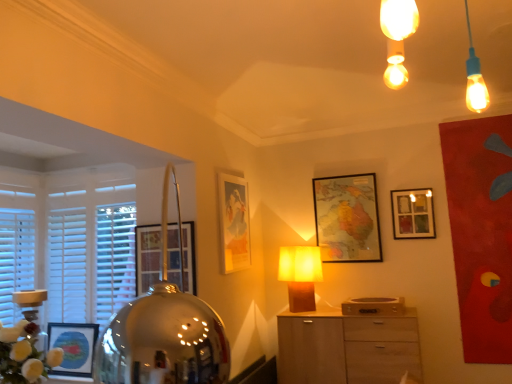
Question: In terms of height, does matte glass picture frame at upper right, the 4th picture frame in the left-to-right sequence, look taller or shorter compared to light wood cabinet at center?

Choices:
 (A) short
 (B) tall

Answer: (A)

Question: Visually, is matte glass picture frame at upper right, which is the 1th picture frame from right to left, positioned to the left or to the right of light wood cabinet at center?

Choices:
 (A) left
 (B) right

Answer: (B)

Question: Estimate the real-world distances between objects in this image. Which object is closer to the white fluffy flowers at lower left?

Choices:
 (A) matte glass picture frame at upper right, the 4th picture frame in the left-to-right sequence
 (B) matte glass picture frame at left, the 1th picture frame when ordered from left to right
 (C) matte gold picture frame at center, the third picture frame positioned from the right
 (D) light wood cabinet at center
 (E) matte yellow fabric lampshade at center

Answer: (B)

Question: Based on their relative distances, which object is farther from the wooden map at center, which appears as the 2th picture frame when viewed from the right?

Choices:
 (A) matte gold picture frame at center, arranged as the 2th picture frame when viewed from the left
 (B) matte glass picture frame at upper right, which is the 1th picture frame from right to left
 (C) white fluffy flowers at lower left
 (D) light wood cabinet at center
 (E) matte yellow fabric lampshade at center

Answer: (C)